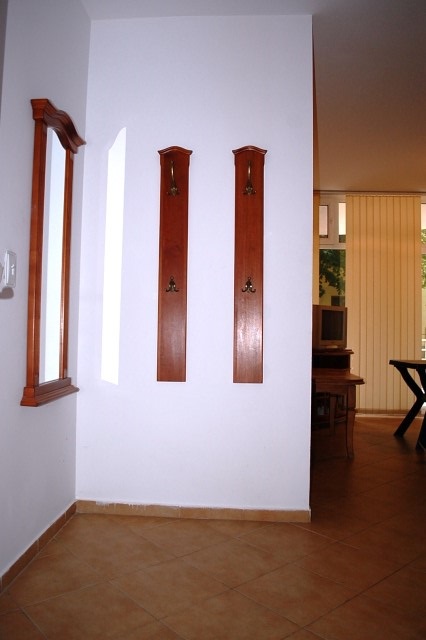
The image size is (426, 640). I want to click on floor, so click(x=203, y=559).